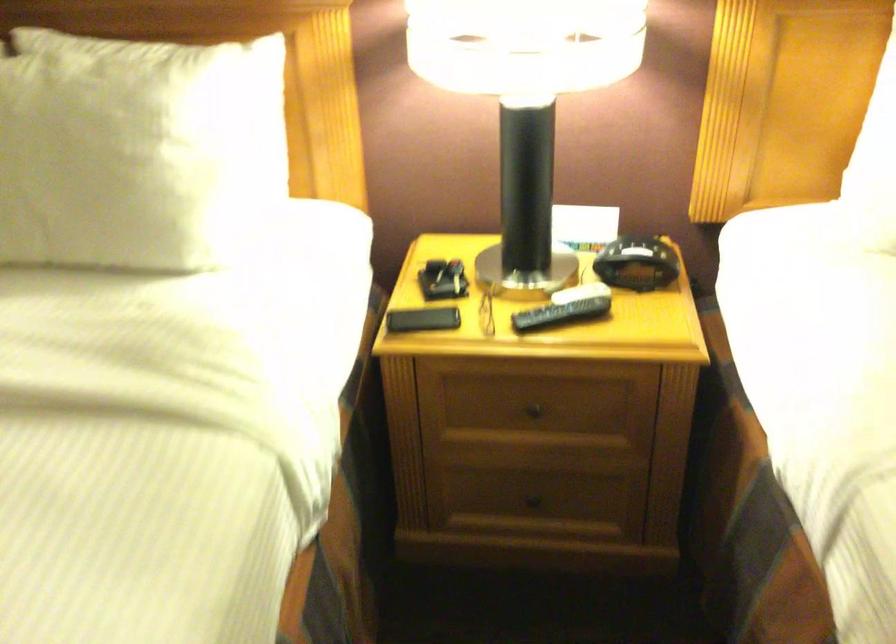
This screenshot has height=644, width=896. What are the coordinates of `black alarm clock` in the screenshot? It's located at pyautogui.click(x=636, y=263).